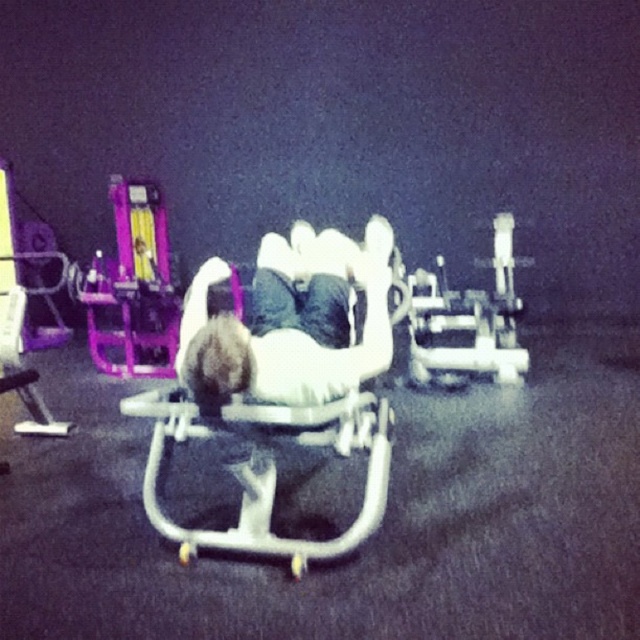
You are an athlete preparing for a workout. You see a white matte bench at center and a white plastic sleigh at center in the gym. Which object is closer to you?

The white matte bench at center is closer to you because it is in front of the white plastic sleigh at center.

You are setting up a workout routine in the gym and need to place a water bottle on the closest object to you. Which object should you choose between the white matte bench at center and the white plastic sleigh at center?

The white plastic sleigh at center is closer to you because the white matte bench at center is positioned on its right side, meaning it is further away.

You are a fitness trainer who needs to place a 12 inch dumbbell between the white matte bench at center and the white plastic sleigh at center. Is there enough space between them to fit the dumbbell?

The distance between the white matte bench at center and the white plastic sleigh at center is 10.66 inches, which is less than the 12 inch dumbbell. Therefore, the dumbbell cannot fit between them.